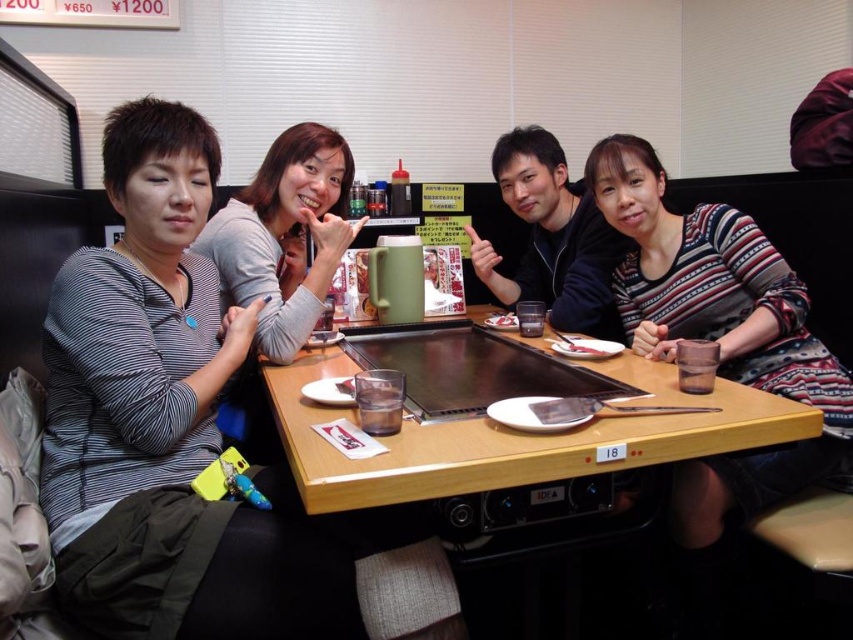
Question: Which point is farther to the camera?

Choices:
 (A) (350, 467)
 (B) (264, 236)
 (C) (564, 337)

Answer: (B)

Question: Which point appears closest to the camera in this image?

Choices:
 (A) (293, 198)
 (B) (781, 481)

Answer: (B)

Question: Which point is farther from the camera taking this photo?

Choices:
 (A) (724, 234)
 (B) (279, 134)
 (C) (582, 348)
 (D) (505, 317)

Answer: (D)

Question: Can you confirm if wooden table at center is positioned to the left of matte gray sweater at upper left?

Choices:
 (A) no
 (B) yes

Answer: (A)

Question: Is wooden table at center wider than pink glossy meat at center?

Choices:
 (A) yes
 (B) no

Answer: (A)

Question: Does matte gray sweater at upper left have a lesser width compared to white glossy rice at center?

Choices:
 (A) no
 (B) yes

Answer: (A)